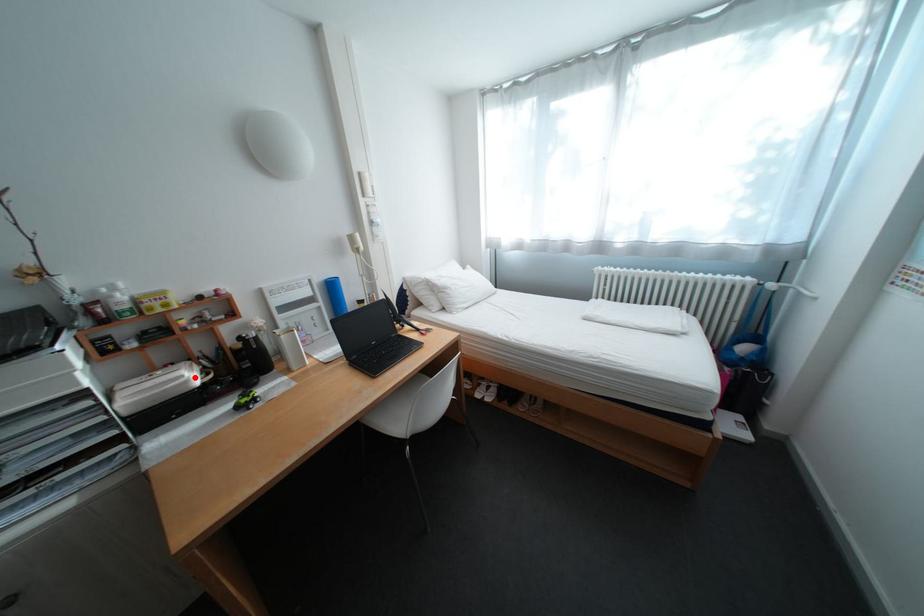
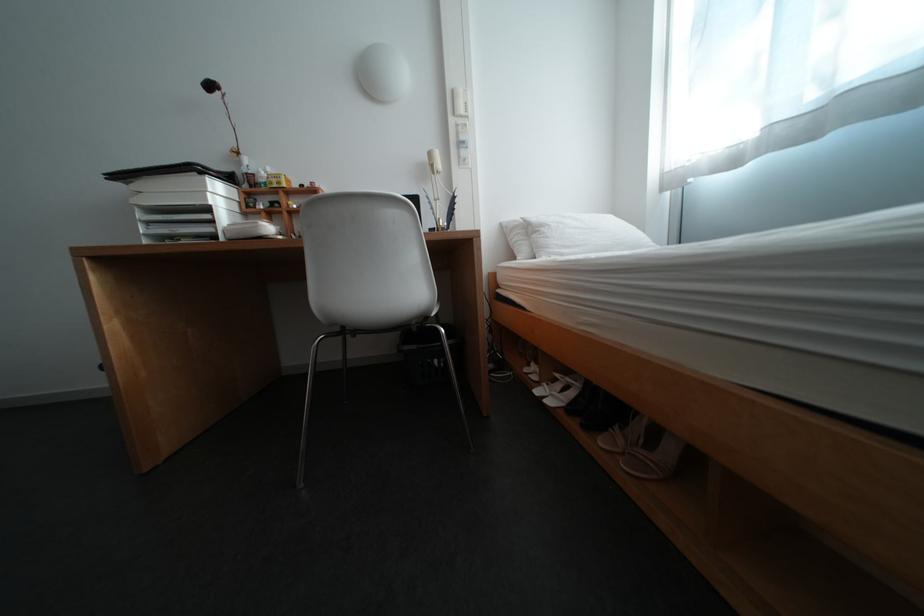
In the second image, find the point that corresponds to the highlighted location in the first image.

(270, 224)